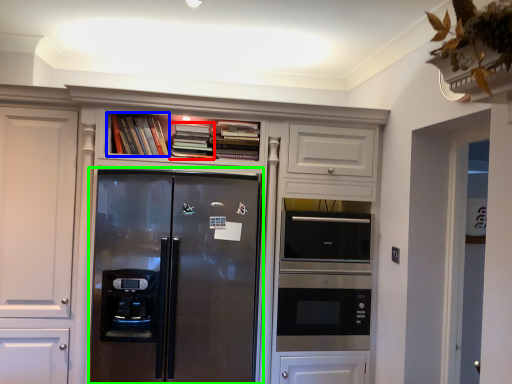
Question: Based on their relative distances, which object is nearer to book (highlighted by a red box)? Choose from book (highlighted by a blue box) and refrigerator (highlighted by a green box).

Choices:
 (A) book
 (B) refrigerator

Answer: (A)